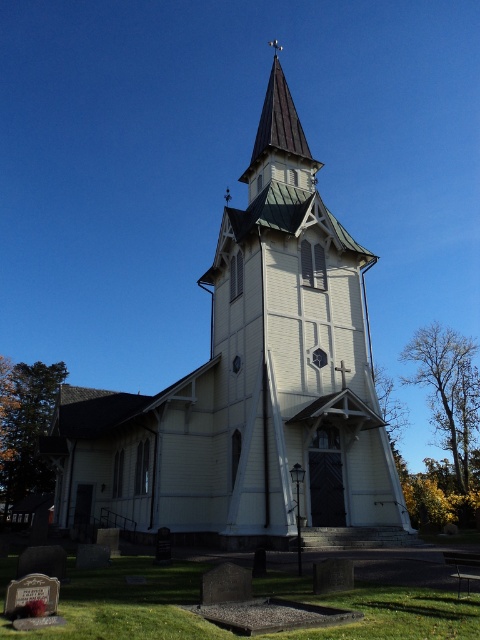
Question: Is the position of white wood church at center more distant than that of shiny copper spire at upper center?

Choices:
 (A) yes
 (B) no

Answer: (B)

Question: Which point appears closest to the camera in this image?

Choices:
 (A) (273, 148)
 (B) (324, 368)

Answer: (B)

Question: Considering the relative positions of white wood church at center and shiny copper spire at upper center in the image provided, where is white wood church at center located with respect to shiny copper spire at upper center?

Choices:
 (A) below
 (B) above

Answer: (A)

Question: Which object is farther from the camera taking this photo?

Choices:
 (A) shiny copper spire at upper center
 (B) white wood church at center

Answer: (A)

Question: Does white wood church at center have a larger size compared to shiny copper spire at upper center?

Choices:
 (A) no
 (B) yes

Answer: (B)